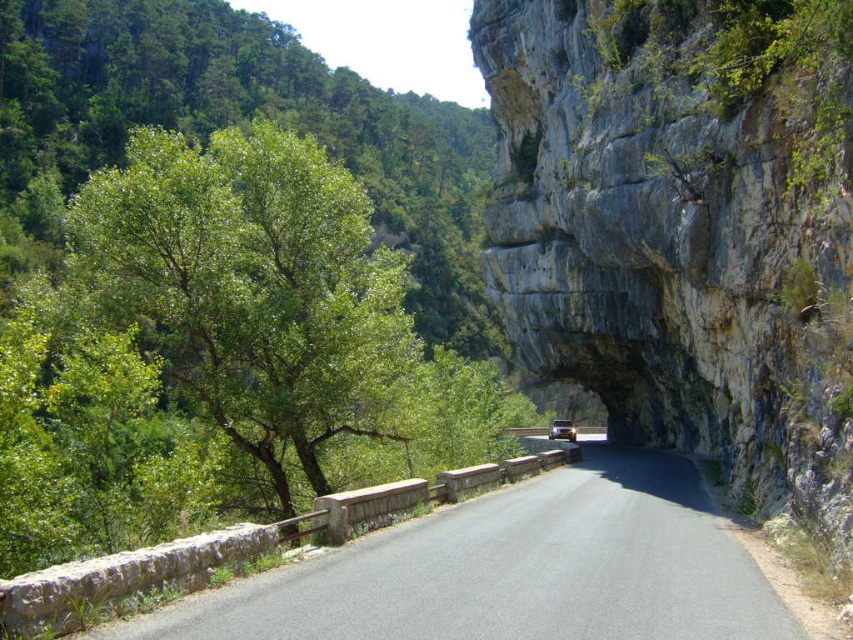
Does asphalt road at center have a smaller size compared to metallic gold car at center?

Indeed, asphalt road at center has a smaller size compared to metallic gold car at center.

Is point (461, 604) positioned in front of point (560, 426)?

That is True.

I want to click on asphalt road at center, so click(514, 570).

Can you confirm if rocky gray at center is positioned to the left of metallic gold car at center?

Yes, rocky gray at center is to the left of metallic gold car at center.

Which of these two, rocky gray at center or metallic gold car at center, stands taller?

rocky gray at center is taller.

The width and height of the screenshot is (853, 640). Identify the location of rocky gray at center. (683, 228).

Can you confirm if rocky gray at center is positioned to the right of asphalt road at center?

Correct, you'll find rocky gray at center to the right of asphalt road at center.

Which is in front, point (721, 10) or point (460, 584)?

Point (460, 584) is more forward.

In order to click on rocky gray at center in this screenshot , I will do `click(683, 228)`.